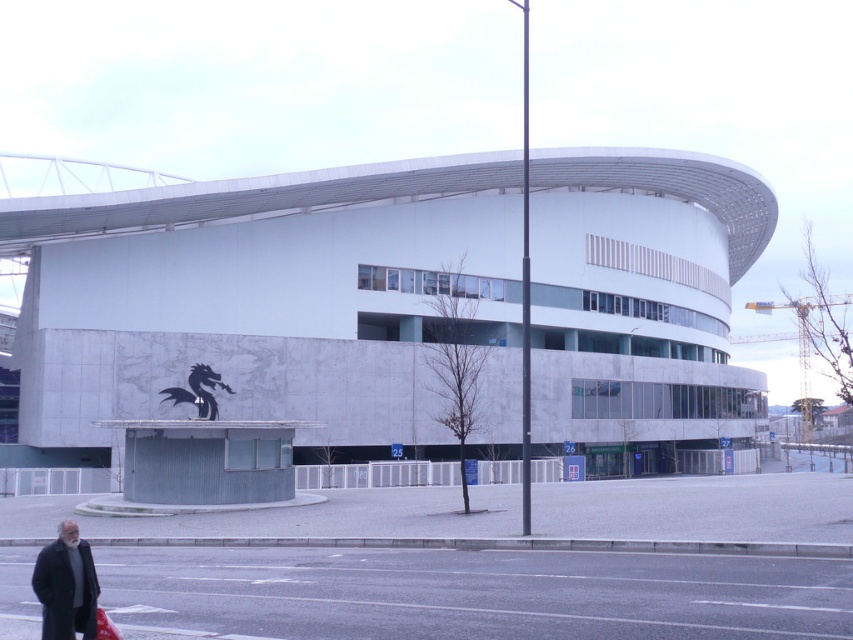
Question: Among these points, which one is farthest from the camera?

Choices:
 (A) (404, 163)
 (B) (83, 547)

Answer: (A)

Question: Which point is closer to the camera?

Choices:
 (A) white marble stadium at center
 (B) dark gray wool coat at lower left

Answer: (B)

Question: Is white marble stadium at center thinner than dark gray wool coat at lower left?

Choices:
 (A) yes
 (B) no

Answer: (B)

Question: Can you confirm if white marble stadium at center is positioned to the right of dark gray wool coat at lower left?

Choices:
 (A) yes
 (B) no

Answer: (A)

Question: Observing the image, what is the correct spatial positioning of white marble stadium at center in reference to dark gray wool coat at lower left?

Choices:
 (A) left
 (B) right

Answer: (B)